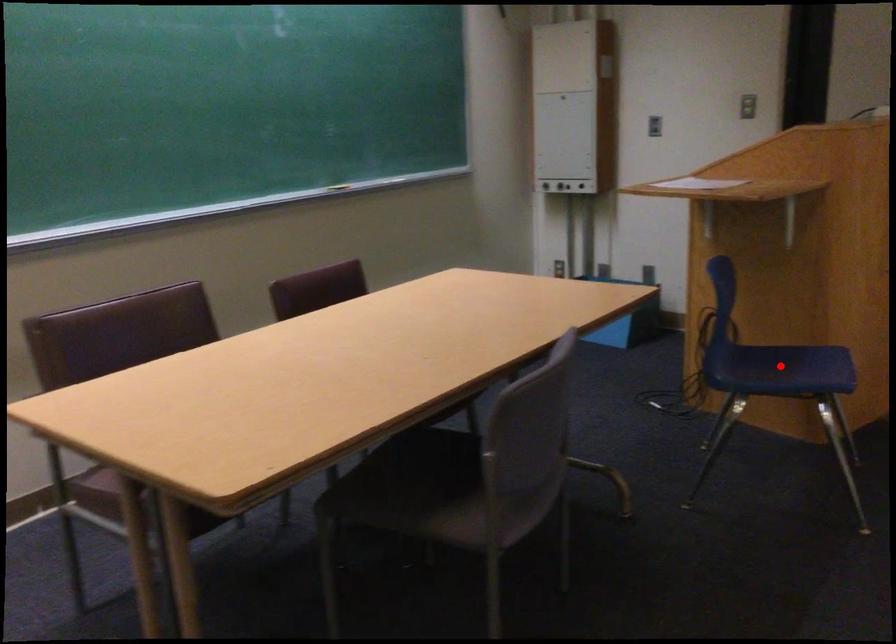
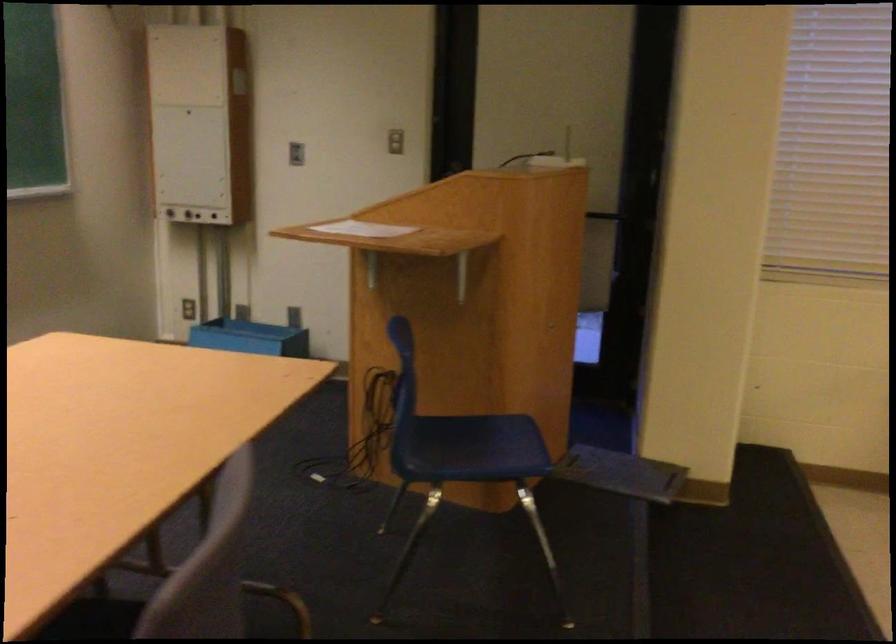
Where in the second image is the point corresponding to the highlighted location from the first image?

(466, 442)